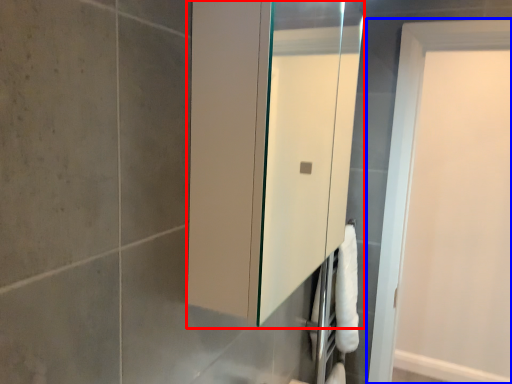
Question: Which point is further to the camera, medicine cabinet (highlighted by a red box) or door (highlighted by a blue box)?

Choices:
 (A) medicine cabinet
 (B) door

Answer: (B)